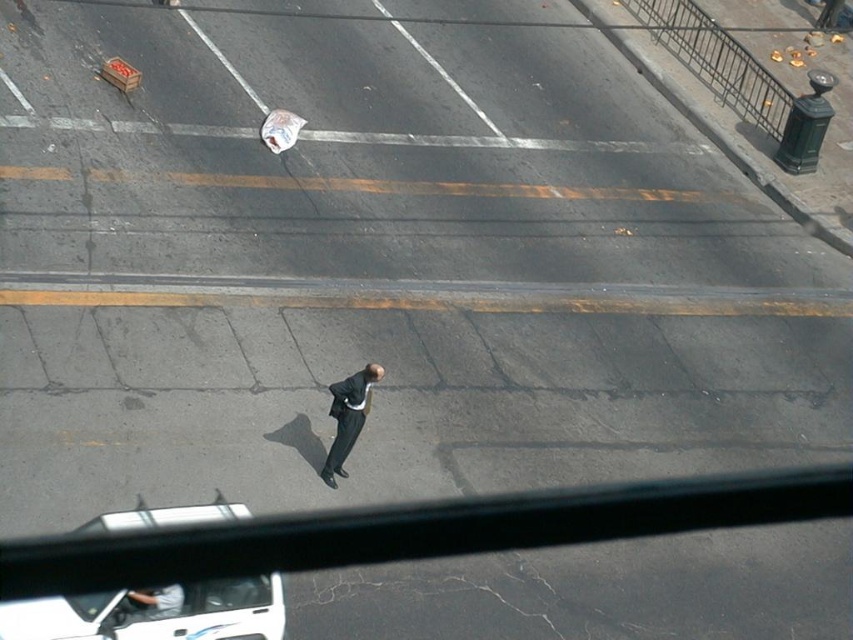
Question: Is white glossy car at lower left thinner than dark gray suit at center?

Choices:
 (A) yes
 (B) no

Answer: (B)

Question: Can you confirm if white glossy car at lower left is positioned to the left of dark gray suit at center?

Choices:
 (A) no
 (B) yes

Answer: (B)

Question: Which point is farther from the camera taking this photo?

Choices:
 (A) (354, 408)
 (B) (136, 602)

Answer: (A)

Question: Which object is closer to the camera taking this photo?

Choices:
 (A) white glossy car at lower left
 (B) dark gray suit at center

Answer: (A)

Question: Among these objects, which one is nearest to the camera?

Choices:
 (A) dark gray suit at center
 (B) white glossy car at lower left

Answer: (B)

Question: Can you confirm if white glossy car at lower left is positioned below dark gray suit at center?

Choices:
 (A) no
 (B) yes

Answer: (B)